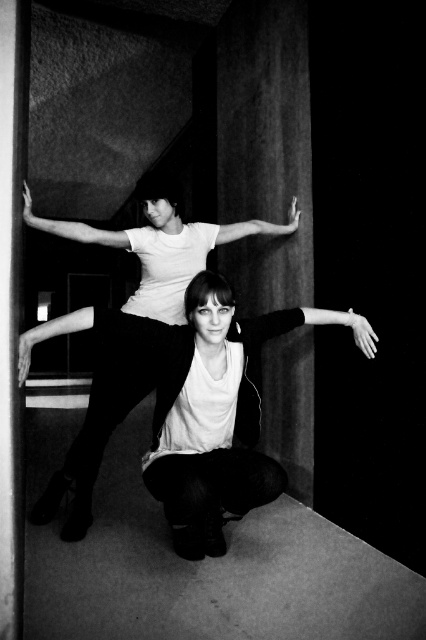
Does matte white shirt at center have a lesser width compared to matte white arm at center?

No, matte white shirt at center is not thinner than matte white arm at center.

Is matte white shirt at center further to the viewer compared to matte white arm at center?

No, it is not.

The image size is (426, 640). What are the coordinates of `matte white shirt at center` in the screenshot? It's located at (160, 248).

What do you see at coordinates (160, 248) in the screenshot? I see `matte white shirt at center` at bounding box center [160, 248].

You are a GUI agent. You are given a task and a screenshot of the screen. Output one action in this format:
    pyautogui.click(x=<x>, y=<y>)
    Task: Click on the matte white shirt at center
    The width and height of the screenshot is (426, 640).
    Given the screenshot: What is the action you would take?
    pyautogui.click(x=160, y=248)

Find the location of `matte white shirt at center`. matte white shirt at center is located at coordinates [160, 248].

Looking at this image, is smooth skin arm at lower center thinner than matte white arm at center?

Yes.

This screenshot has width=426, height=640. In order to click on smooth skin arm at lower center in this screenshot , I will do `click(345, 324)`.

Is point (365, 339) closer to camera compared to point (247, 228)?

Yes, it is in front of point (247, 228).

At what (x,y) coordinates should I click in order to perform the action: click on smooth skin arm at lower center. Please return your answer as a coordinate pair (x, y). Looking at the image, I should click on (345, 324).